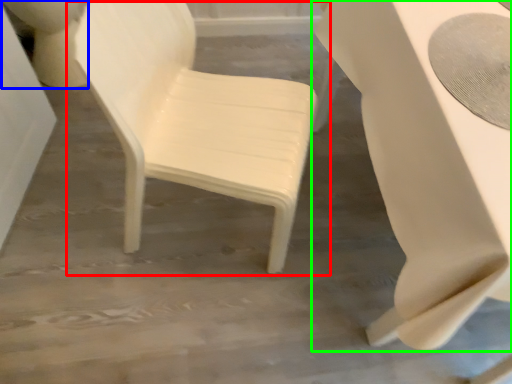
Question: Which is farther away from chair (highlighted by a red box)? toilet bowl (highlighted by a blue box) or table (highlighted by a green box)?

Choices:
 (A) toilet bowl
 (B) table

Answer: (A)